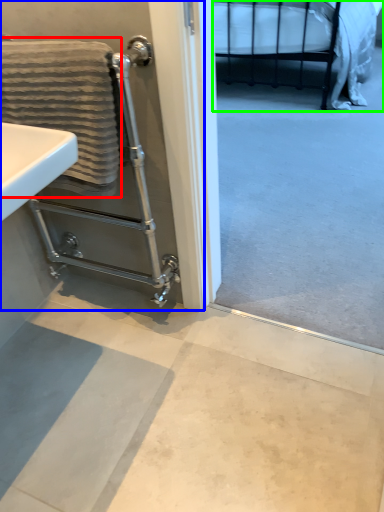
Question: Which object is the closest to the bath towel (highlighted by a red box)? Choose among these: screen door (highlighted by a blue box) or bed (highlighted by a green box).

Choices:
 (A) screen door
 (B) bed

Answer: (A)